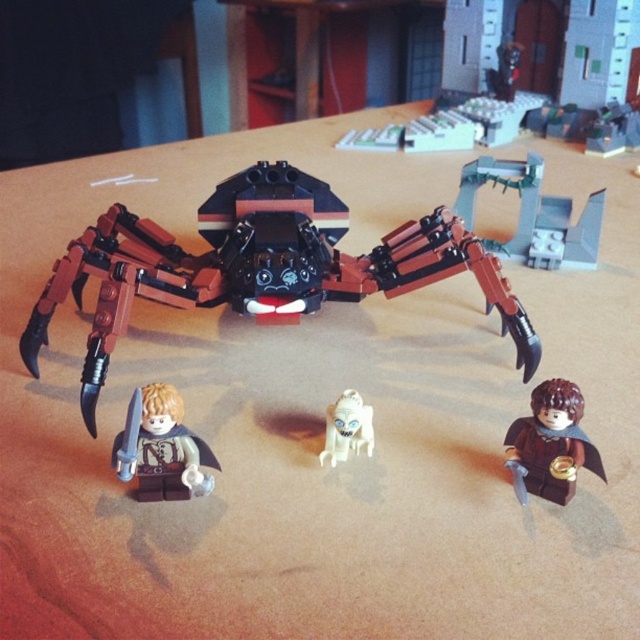
Based on the photo, you are a photographer holding a camera and want to take a photo of the brown matte minifigure at lower right in the LEGO diorama. The camera has a focal length of 50mm. According to the rule of thirds, where should you position the minifigure in the frame?

The rule of thirds involves dividing the frame into a 3x3 grid and placing the subject at the intersection points. Position the brown matte minifigure at lower right so that its eyes or focal point align with one of the upper intersection points to create a balanced composition.

You are organizing a LEGO display and need to place both the wooden table at upper center and the gray metallic structure at upper right. Since you have limited space, which object should you prioritize placing first based on their sizes?

You should prioritize placing the wooden table at upper center first because it is larger in size than the gray metallic structure at upper right, so it requires more space.

Based on the photo, you are a LEGO enthusiast examining this diorama. You notice the brown matte minifigure at lower right and the white matte ghost at center. Which object is located below the other?

The brown matte minifigure at lower right is positioned under the white matte ghost at center, so the brown matte minifigure is below the white matte ghost.